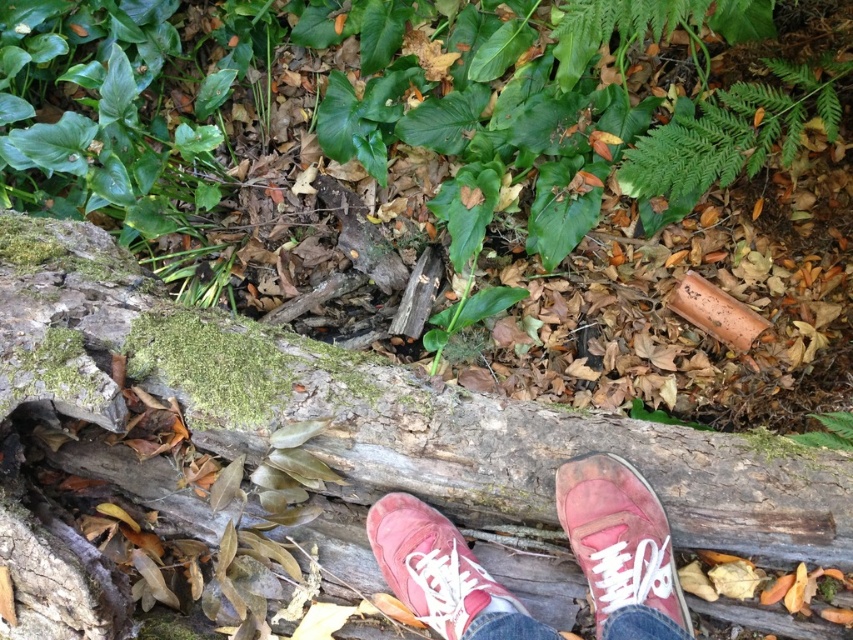
Consider the image. Which is more to the right, matte pink canvas shoe at center or matte pink sneaker at center?

From the viewer's perspective, matte pink canvas shoe at center appears more on the right side.

Is point (579, 563) closer to camera compared to point (415, 604)?

No, it is not.

Find the location of a particular element. This screenshot has width=853, height=640. matte pink canvas shoe at center is located at coordinates (618, 538).

Can you confirm if rough bark log at center is positioned above matte pink sneaker at center?

Yes.

Can you confirm if rough bark log at center is thinner than matte pink sneaker at center?

Incorrect, rough bark log at center's width is not less than matte pink sneaker at center's.

Which is in front, point (402, 403) or point (372, 529)?

Point (372, 529) is in front.

Where is `rough bark log at center`? This screenshot has height=640, width=853. rough bark log at center is located at coordinates (381, 410).

Can you confirm if pink canvas shoes at center is shorter than matte pink canvas shoe at center?

No.

Is pink canvas shoes at center above matte pink canvas shoe at center?

Incorrect, pink canvas shoes at center is not positioned above matte pink canvas shoe at center.

Is point (650, 529) closer to camera compared to point (601, 500)?

Yes, point (650, 529) is closer to viewer.

Locate an element on the screen. The image size is (853, 640). pink canvas shoes at center is located at coordinates (618, 538).